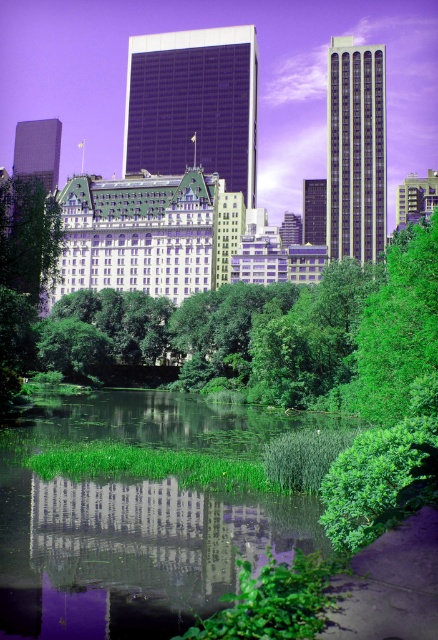
Question: Which is farther from the purple glass skyscraper at center?

Choices:
 (A) green leafy tree at left
 (B) matte glass skyscraper at upper left
 (C) white glossy hotel at center
 (D) matte green building at upper center

Answer: (A)

Question: Is green leafy tree at left positioned in front of matte glass skyscraper at upper left?

Choices:
 (A) yes
 (B) no

Answer: (A)

Question: Can you confirm if green leafy tree at left is wider than matte green building at upper center?

Choices:
 (A) yes
 (B) no

Answer: (B)

Question: Is green leafy tree at right smaller than matte green building at upper center?

Choices:
 (A) no
 (B) yes

Answer: (A)

Question: Which point is farther to the camera?

Choices:
 (A) matte green building at upper center
 (B) matte glass skyscraper at upper left

Answer: (A)

Question: Which point is closer to the camera?

Choices:
 (A) (329, 250)
 (B) (48, 241)

Answer: (B)